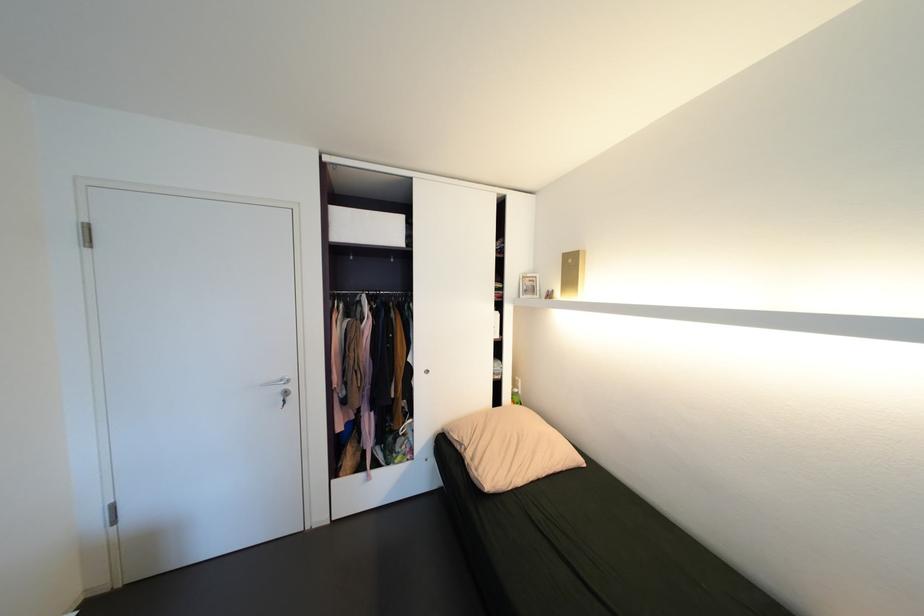
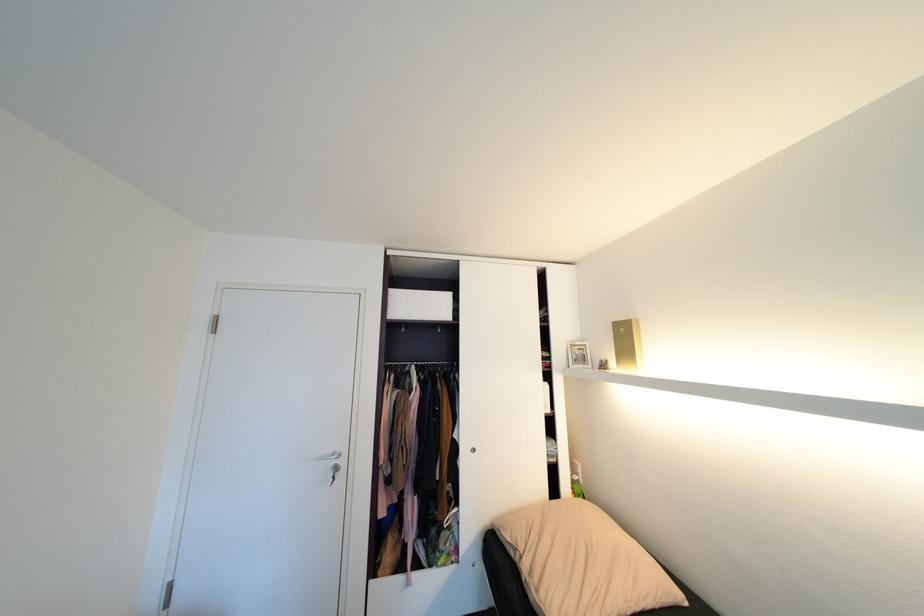
In the second image, find the point that corresponds to (289,392) in the first image.

(341, 467)